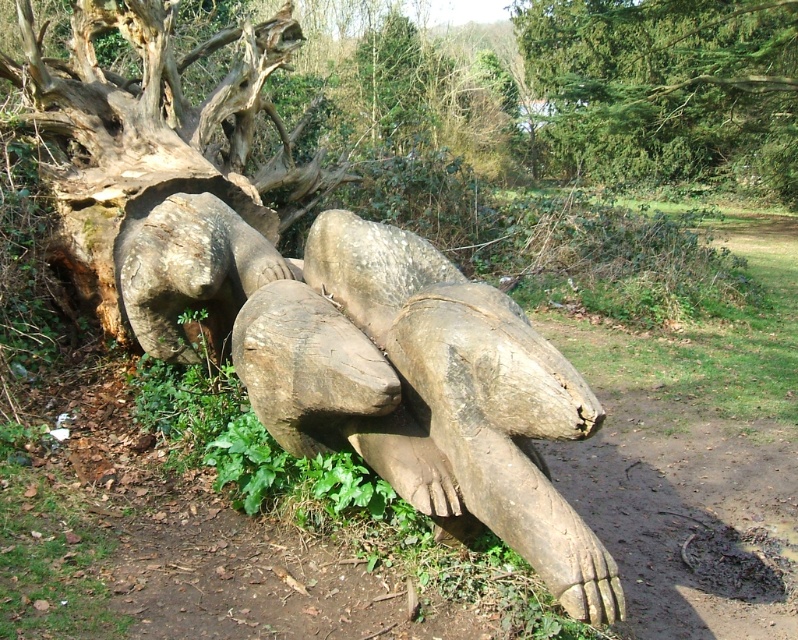
Which is above, natural wood sculpture at center or rough bark tree trunk at center?

rough bark tree trunk at center

Between natural wood sculpture at center and rough bark tree trunk at center, which one appears on the right side from the viewer's perspective?

natural wood sculpture at center is more to the right.

Is point (220, 246) positioned in front of point (157, 227)?

Yes, it is.

You are a GUI agent. You are given a task and a screenshot of the screen. Output one action in this format:
    pyautogui.click(x=<x>, y=<y>)
    Task: Click on the natural wood sculpture at center
    The image size is (798, 640).
    Given the screenshot: What is the action you would take?
    pyautogui.click(x=382, y=371)

Between point (492, 516) and point (619, 42), which one is positioned in front?

Positioned in front is point (492, 516).

In the scene shown: Is natural wood sculpture at center wider than green textured tree at upper center?

Incorrect, natural wood sculpture at center's width does not surpass green textured tree at upper center's.

Image resolution: width=798 pixels, height=640 pixels. Identify the location of natural wood sculpture at center. (382, 371).

Does green textured tree at upper center lie in front of rough bark tree trunk at center?

No, it is not.

In the scene shown: Who is taller, green textured tree at upper center or rough bark tree trunk at center?

green textured tree at upper center is taller.

Is point (585, 163) less distant than point (143, 344)?

No.

Where is `green textured tree at upper center`? This screenshot has width=798, height=640. green textured tree at upper center is located at coordinates (666, 88).